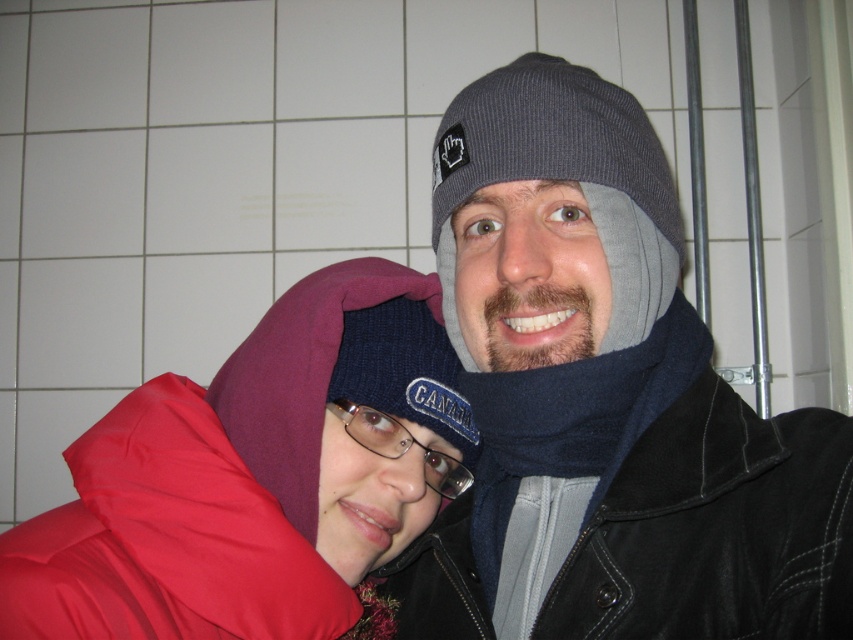
Is point (381, 384) closer to viewer compared to point (515, 132)?

No, (381, 384) is further to viewer.

Does point (258, 472) come farther from viewer compared to point (669, 212)?

Yes, point (258, 472) is farther from viewer.

The height and width of the screenshot is (640, 853). What are the coordinates of `matte red jacket at lower left` in the screenshot? It's located at (256, 476).

Who is more distant from viewer, (x=364, y=472) or (x=573, y=381)?

Positioned behind is point (x=364, y=472).

Is point (368, 444) behind point (556, 371)?

Yes, point (368, 444) is behind point (556, 371).

Find the location of a particular element. The height and width of the screenshot is (640, 853). matte red jacket at lower left is located at coordinates (256, 476).

Is navy wool scarf at right bigger than gray knit beanie at center?

Correct, navy wool scarf at right is larger in size than gray knit beanie at center.

Is navy wool scarf at right above gray knit beanie at center?

No, navy wool scarf at right is not above gray knit beanie at center.

This screenshot has width=853, height=640. Identify the location of navy wool scarf at right. pos(566,445).

I want to click on navy wool scarf at right, so click(566, 445).